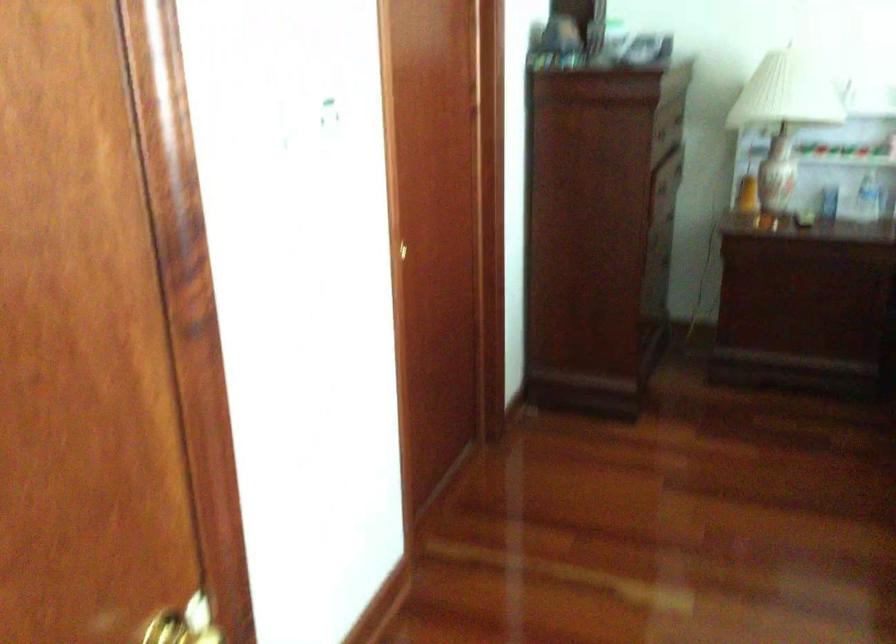
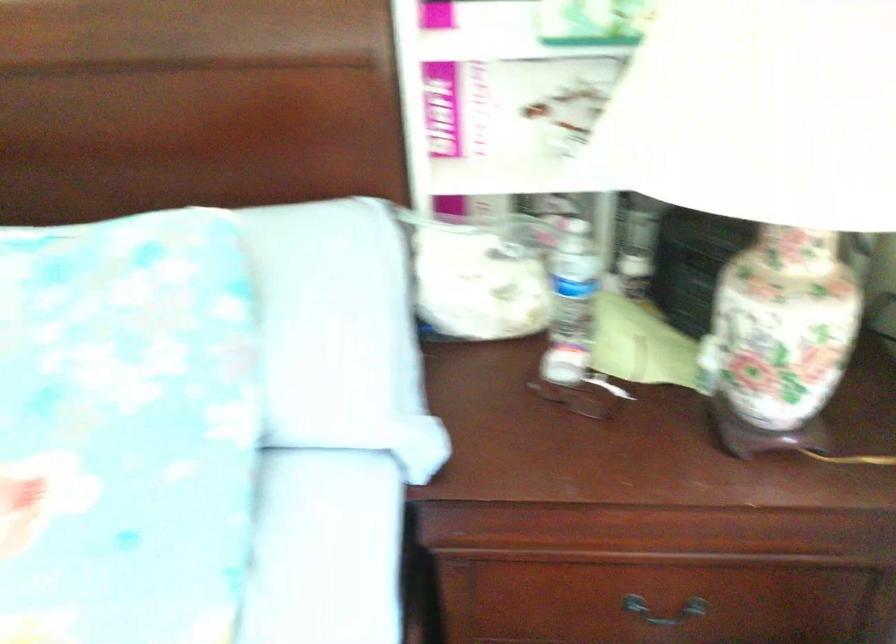
What movement of the cameraman would produce the second image?

The cameraman walked toward right, forward.